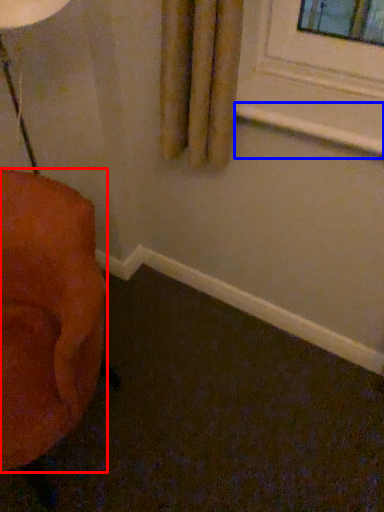
Question: Which point is closer to the camera, furniture (highlighted by a red box) or window sill (highlighted by a blue box)?

Choices:
 (A) furniture
 (B) window sill

Answer: (A)